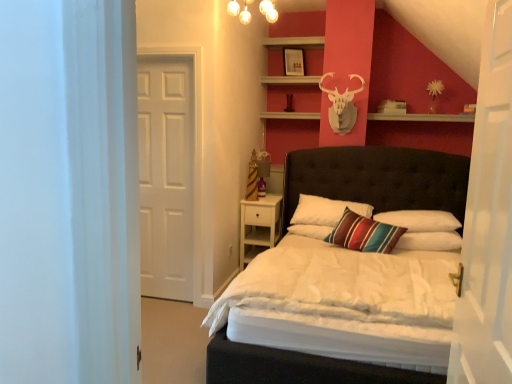
Question: From a real-world perspective, is white wood nightstand at center on top of white soft pillow at center, marked as the third pillow in a left-to-right arrangement?

Choices:
 (A) yes
 (B) no

Answer: (B)

Question: Can you confirm if white wood nightstand at center is taller than white soft pillow at center, marked as the third pillow in a left-to-right arrangement?

Choices:
 (A) yes
 (B) no

Answer: (A)

Question: Is white wood nightstand at center far from white soft pillow at center, the 1th pillow positioned from the right?

Choices:
 (A) no
 (B) yes

Answer: (B)

Question: Is white wood nightstand at center bigger than white soft pillow at center, the 1th pillow positioned from the right?

Choices:
 (A) no
 (B) yes

Answer: (B)

Question: Considering the relative sizes of white wood nightstand at center and white soft pillow at center, the 1th pillow positioned from the right, in the image provided, is white wood nightstand at center shorter than white soft pillow at center, the 1th pillow positioned from the right,?

Choices:
 (A) no
 (B) yes

Answer: (A)

Question: Can we say white wood nightstand at center lies outside white soft pillow at center, the 1th pillow positioned from the right?

Choices:
 (A) yes
 (B) no

Answer: (A)

Question: Is matte glass chandelier at upper center facing away from white wooden door at right, which appears as the first door when viewed from the front?

Choices:
 (A) no
 (B) yes

Answer: (A)

Question: Is matte glass chandelier at upper center aimed at white wooden door at right, which appears as the second door when viewed from the back?

Choices:
 (A) yes
 (B) no

Answer: (B)

Question: Does matte glass chandelier at upper center come in front of white wooden door at right, the second door when ordered from left to right?

Choices:
 (A) yes
 (B) no

Answer: (B)

Question: Can you confirm if matte glass chandelier at upper center is shorter than white wooden door at right, the second door when ordered from left to right?

Choices:
 (A) yes
 (B) no

Answer: (A)

Question: Does matte glass chandelier at upper center come behind white wooden door at right, positioned as the first door in right-to-left order?

Choices:
 (A) yes
 (B) no

Answer: (A)

Question: Is matte glass chandelier at upper center to the left of white wooden door at right, the second door when ordered from left to right, from the viewer's perspective?

Choices:
 (A) no
 (B) yes

Answer: (B)

Question: From the image's perspective, is matte glass chandelier at upper center over tufted leather bed at center?

Choices:
 (A) yes
 (B) no

Answer: (A)